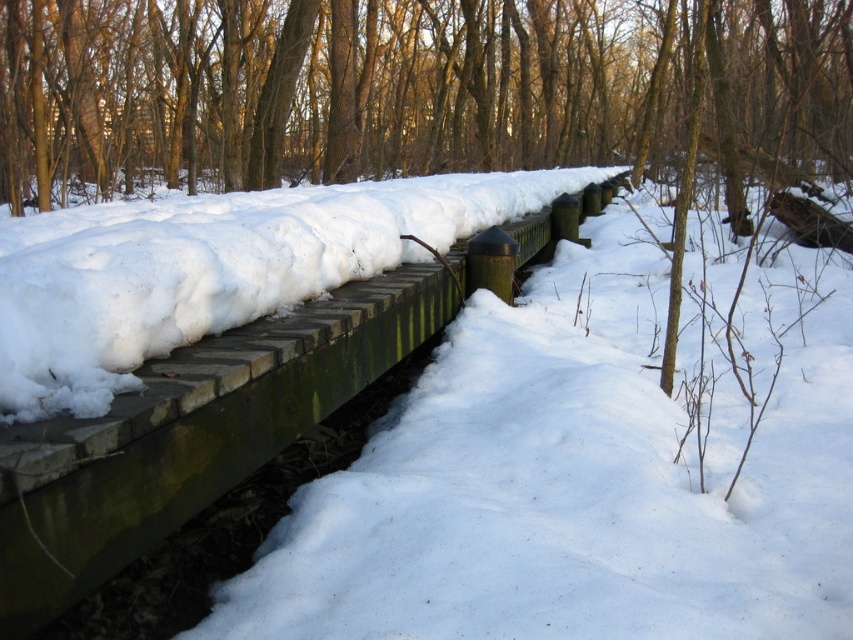
Question: Which of the following is the farthest from the observer?

Choices:
 (A) (520, 106)
 (B) (259, 387)

Answer: (A)

Question: Is brown wood tree at upper center to the left of green wood rail at center from the viewer's perspective?

Choices:
 (A) no
 (B) yes

Answer: (A)

Question: Is brown wood tree at upper center above green wood rail at center?

Choices:
 (A) no
 (B) yes

Answer: (B)

Question: Which object is closer to the camera taking this photo?

Choices:
 (A) brown wood tree at upper center
 (B) green wood rail at center

Answer: (B)

Question: Is brown wood tree at upper center wider than green wood rail at center?

Choices:
 (A) no
 (B) yes

Answer: (B)